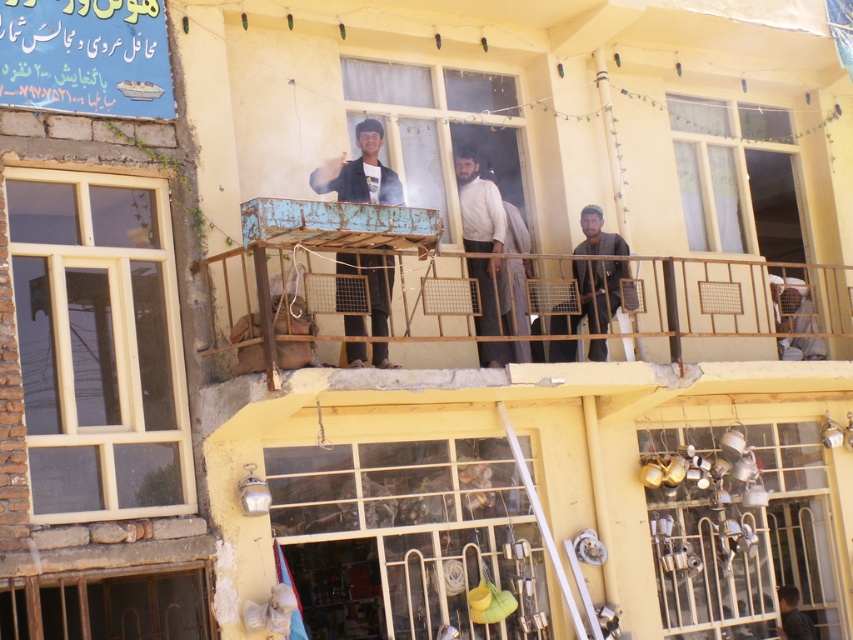
Question: Is dark blue shirt at center wider than light brown fabric shirt at center?

Choices:
 (A) no
 (B) yes

Answer: (B)

Question: Does light brown fabric shirt at center appear over dark gray shirt at lower right?

Choices:
 (A) no
 (B) yes

Answer: (B)

Question: Which of the following is the closest to the observer?

Choices:
 (A) (593, 275)
 (B) (9, 632)
 (C) (367, 196)

Answer: (B)

Question: Which object is positioned farthest from the transparent glass window at center?

Choices:
 (A) brown wooden balcony at center
 (B) matte cream window at left

Answer: (A)

Question: Is wooden window frame at lower left to the right of dark brown fabric at center from the viewer's perspective?

Choices:
 (A) yes
 (B) no

Answer: (B)

Question: Which point is closer to the camera?

Choices:
 (A) transparent glass window at center
 (B) dark gray shirt at lower right

Answer: (A)